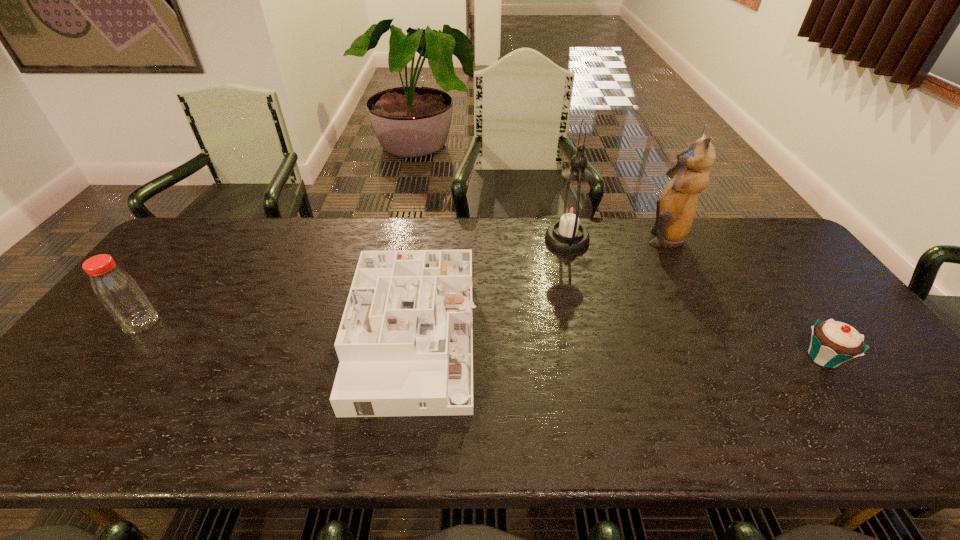
The width and height of the screenshot is (960, 540). What are the coordinates of `vacant area at the right edge of the desktop` in the screenshot? It's located at (853, 403).

The image size is (960, 540). In the image, there is a desktop. Identify the location of vacant space at the far right corner. (756, 247).

Image resolution: width=960 pixels, height=540 pixels. I want to click on free space between the cupcake and the cat, so click(x=744, y=297).

What are the coordinates of `free point between the third object from left to right and the fourth object from right to left` in the screenshot? It's located at (491, 291).

This screenshot has height=540, width=960. In order to click on empty space that is in between the bottle and the dollhouse in this screenshot , I will do `click(278, 332)`.

Locate an element on the screen. free space between the dollhouse and the oil lamp is located at coordinates (491, 291).

In order to click on blank region between the rightmost object and the third shortest object in this screenshot , I will do `click(482, 340)`.

What are the coordinates of `free spot between the dollhouse and the oil lamp` in the screenshot? It's located at (491, 291).

Find the location of `free space between the oil lamp and the cat`. free space between the oil lamp and the cat is located at coordinates (616, 238).

Identify the location of vacant area between the bottle and the cupcake. (482, 340).